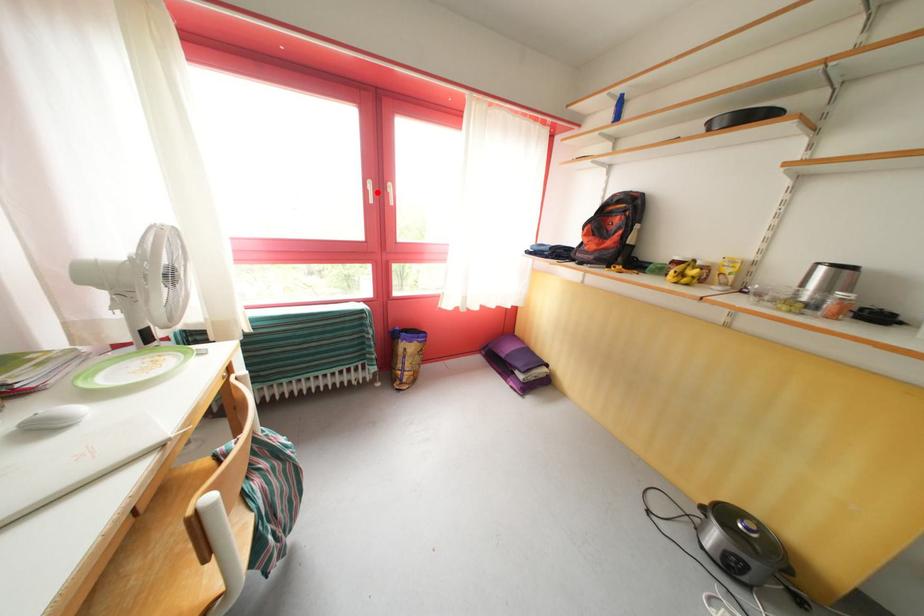
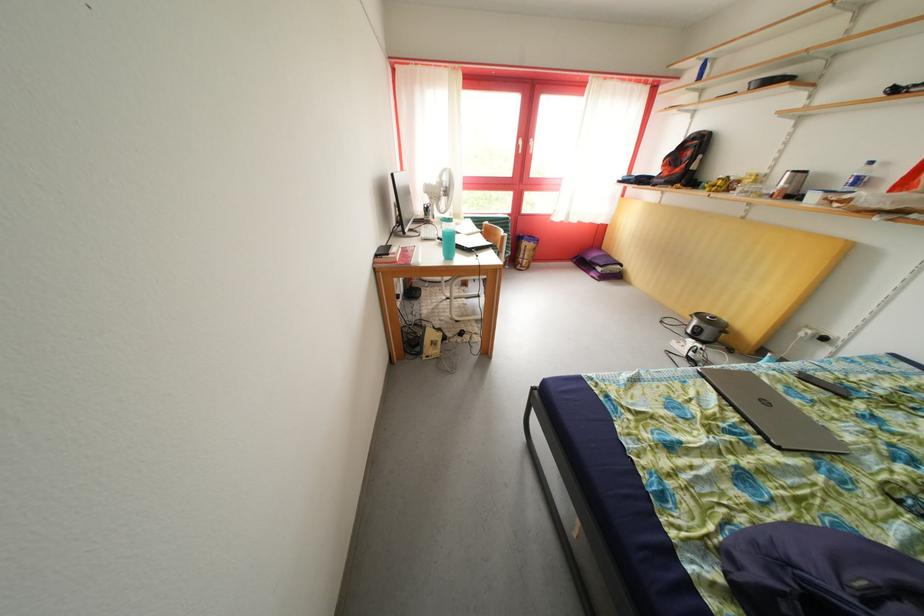
Where in the second image is the point corresponding to the highlighted location from the first image?

(528, 148)